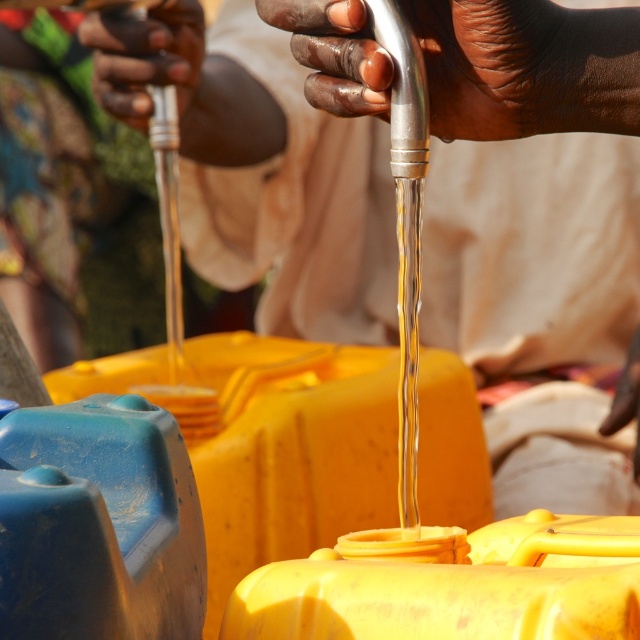
You are a maintenance worker who needs to inspect the metallic silver faucet at upper center. Your tool kit is 28 inches long. Can you reach the faucet without moving any objects?

The metallic silver faucet at upper center is 27.55 inches away from the viewer, which is within the 28 inch length of the tool kit. Therefore, the worker can reach the faucet without moving any objects.

In the scene shown: You are standing at a water dispensing area and need to reach a point that is 30.08 inches away from you. Can you estimate whether the point marked at coordinates point (461, 120) is within your reach?

The point marked at coordinates point (461, 120) is 30.08 inches away from the viewer, which is approximately 2.5 feet. The average human arm length is about 2.5 feet, so it may be reachable if you stretch out your arm fully.

You are standing at the water point and need to choose between two points to place your container. The first point is at coordinates point (304, 20) and the second is at point (132, 67). Based on their positions, which point is closer to you?

Point (304, 20) is in front of point (132, 67), so placing your container at point (304, 20) would be closer to you.